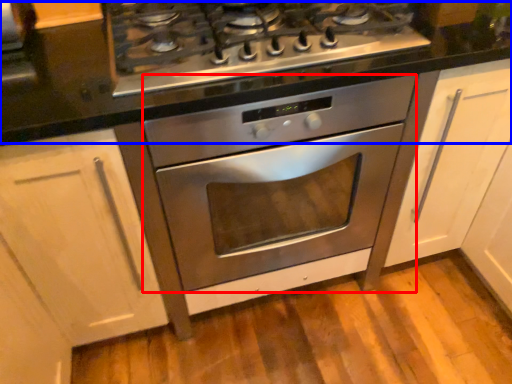
Question: Among these objects, which one is farthest to the camera, oven (highlighted by a red box) or counter top (highlighted by a blue box)?

Choices:
 (A) oven
 (B) counter top

Answer: (A)